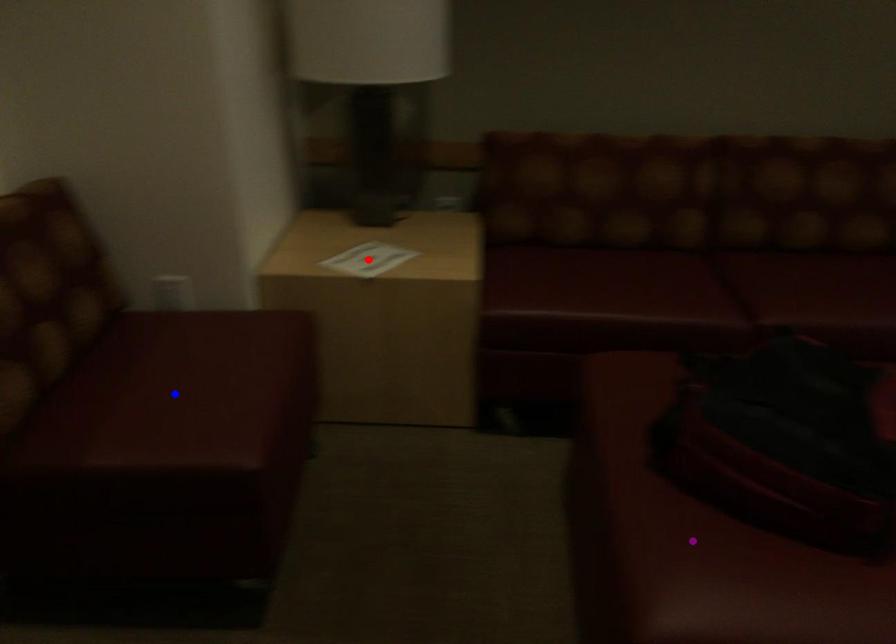
Order these from nearest to farthest:
- blue point
- purple point
- red point

red point, blue point, purple point